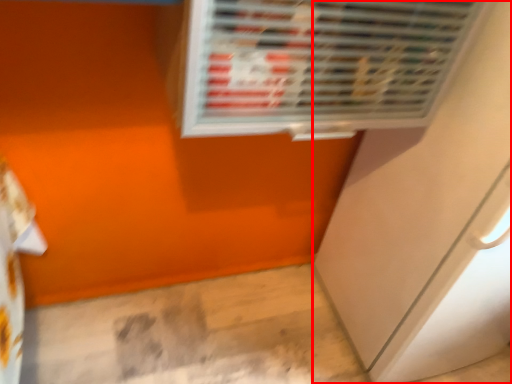
Question: Considering the relative positions of screen door (annotated by the red box) and air conditioning in the image provided, where is screen door (annotated by the red box) located with respect to the staircase?

Choices:
 (A) left
 (B) right

Answer: (B)